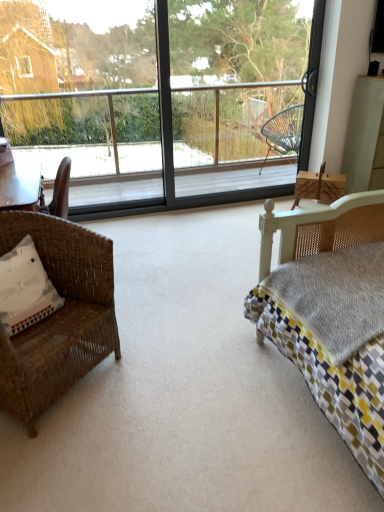
Question: From a real-world perspective, is transparent glass window at center positioned over white fabric pillow at left based on gravity?

Choices:
 (A) yes
 (B) no

Answer: (A)

Question: Is transparent glass window at center at the right side of white fabric pillow at left?

Choices:
 (A) no
 (B) yes

Answer: (B)

Question: Does transparent glass window at center have a lesser height compared to white fabric pillow at left?

Choices:
 (A) no
 (B) yes

Answer: (A)

Question: From the image's perspective, is transparent glass window at center beneath white fabric pillow at left?

Choices:
 (A) yes
 (B) no

Answer: (B)

Question: Can we say transparent glass window at center lies outside white fabric pillow at left?

Choices:
 (A) no
 (B) yes

Answer: (B)

Question: Is transparent glass window at center looking in the opposite direction of white fabric pillow at left?

Choices:
 (A) no
 (B) yes

Answer: (A)

Question: Is transparent glass window at center shorter than woven brown chair at left?

Choices:
 (A) yes
 (B) no

Answer: (B)

Question: Considering the relative sizes of transparent glass window at center and woven brown chair at left in the image provided, is transparent glass window at center smaller than woven brown chair at left?

Choices:
 (A) yes
 (B) no

Answer: (B)

Question: From a real-world perspective, is transparent glass window at center located beneath woven brown chair at left?

Choices:
 (A) no
 (B) yes

Answer: (A)

Question: From the image's perspective, is transparent glass window at center beneath woven brown chair at left?

Choices:
 (A) yes
 (B) no

Answer: (B)

Question: Does transparent glass window at center have a greater height compared to woven brown chair at left?

Choices:
 (A) yes
 (B) no

Answer: (A)

Question: Does transparent glass window at center have a greater width compared to woven brown chair at left?

Choices:
 (A) no
 (B) yes

Answer: (A)

Question: Does transparent glass screen door at center have a greater height compared to white fabric pillow at left?

Choices:
 (A) yes
 (B) no

Answer: (A)